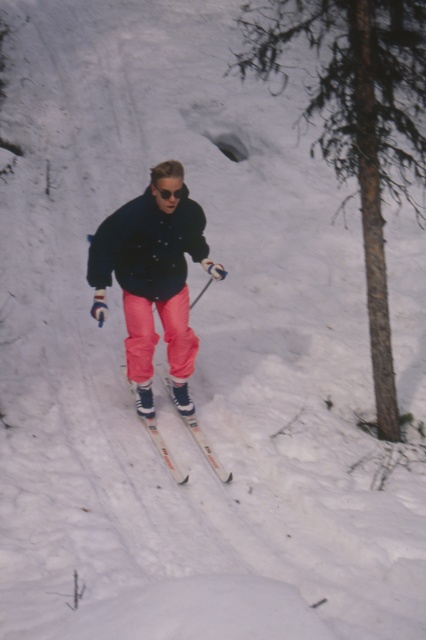
Is point (89, 252) behind point (193, 436)?

That is False.

Is matte black jacket at center positioned at the back of white plastic ski at center?

No, it is not.

Is point (158, 220) behind point (195, 432)?

No.

Identify the location of matte black jacket at center. (152, 280).

Who is positioned more to the right, brown rough tree trunk at center right or sunglasses at center?

Positioned to the right is brown rough tree trunk at center right.

Between point (374, 125) and point (175, 189), which one is positioned behind?

The point (374, 125) is more distant.

Is point (247, 36) positioned before point (184, 188)?

No.

The image size is (426, 640). Find the location of `brown rough tree trunk at center right`. brown rough tree trunk at center right is located at coordinates (359, 124).

How far apart are white plastic ski at center and sunglasses at center?

white plastic ski at center is 2.11 meters from sunglasses at center.

Is point (169, 387) farther from camera compared to point (161, 195)?

That is True.

Who is more distant from viewer, (x=160, y=371) or (x=187, y=193)?

Point (x=160, y=371)

Locate an element on the screen. The image size is (426, 640). white plastic ski at center is located at coordinates (206, 449).